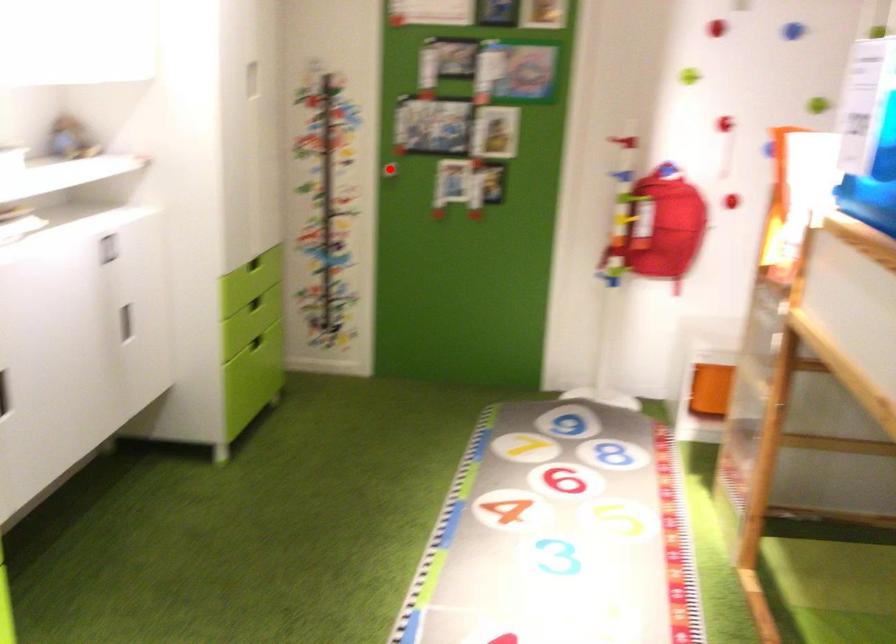
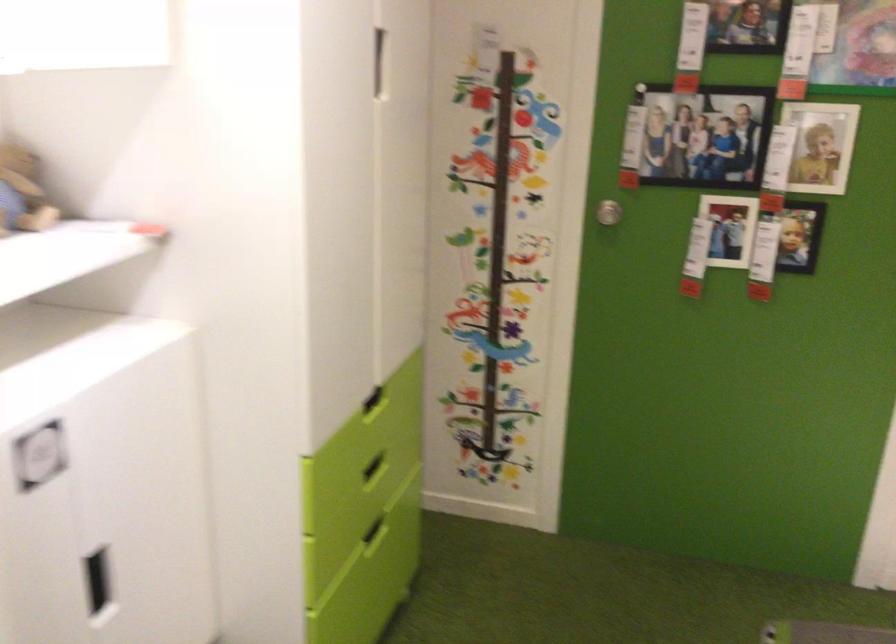
Question: I am providing you with two images of the same scene from different viewpoints. A red point is shown in image1. For the corresponding object point in image2, is it positioned nearer or farther from the camera?

Choices:
 (A) Nearer
 (B) Farther

Answer: (A)